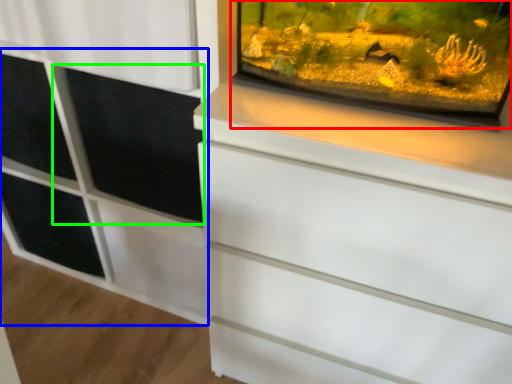
Question: Which is farther away from glass box (highlighted by a red box)? side cabinet (highlighted by a blue box) or screen door (highlighted by a green box)?

Choices:
 (A) side cabinet
 (B) screen door

Answer: (A)